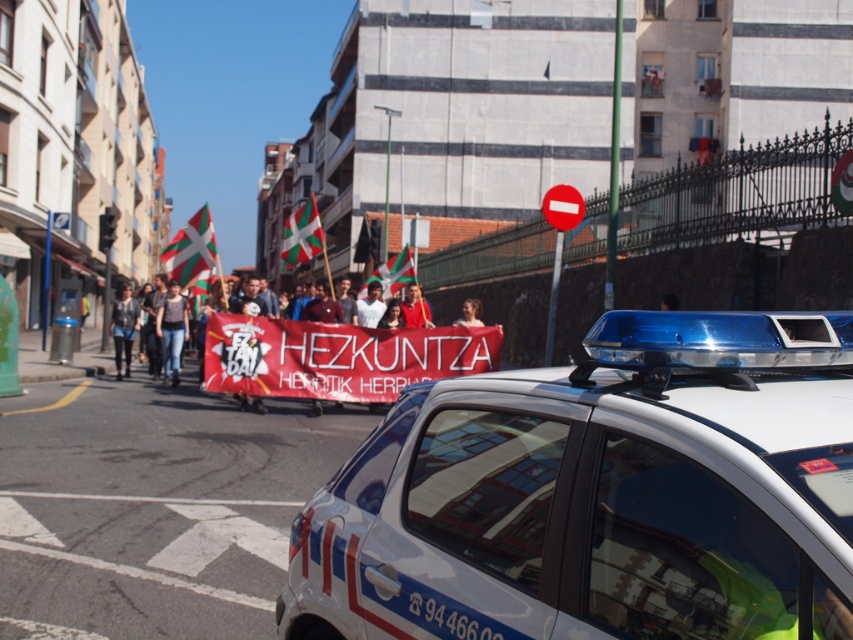
You are a photographer at the protest. You want to capture both the matte red banner at center and the green and white fabric flag at center in a single frame. Which banner should you focus on to ensure both fit in the shot?

The matte red banner at center is wider than the green and white fabric flag at center, so focusing on the matte red banner at center will ensure both banners fit in the shot.

You are a photographer standing on the sidewalk and want to capture both the white glossy police car at center and the denim jacket at left in a single shot. Which object should you focus on first to ensure both are in frame?

The white glossy police car at center is shorter than the denim jacket at left, so you should focus on the denim jacket at left first to ensure both are in frame.

You are a pedestrian standing on the sidewalk and see the white glossy police car at center and the denim jacket at left. Which object is closer to the ground?

The white glossy police car at center is closer to the ground because it is below the denim jacket at left.